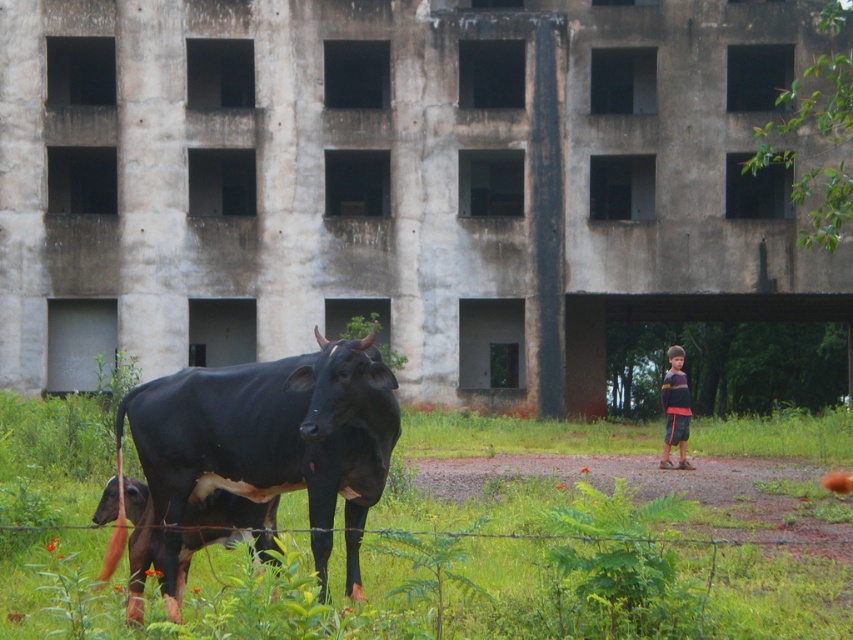
Question: Is green grass at lower left in front of black glossy bull at center?

Choices:
 (A) yes
 (B) no

Answer: (A)

Question: Which point is closer to the camera?

Choices:
 (A) black glossy bull at center
 (B) green grass at lower left
 (C) striped long-sleeve shirt at right

Answer: (B)

Question: Among these points, which one is farthest from the camera?

Choices:
 (A) (323, 476)
 (B) (744, 557)
 (C) (685, 404)

Answer: (C)

Question: Among these objects, which one is nearest to the camera?

Choices:
 (A) black glossy bull at center
 (B) striped long-sleeve shirt at right

Answer: (A)

Question: Does black glossy bull at center have a smaller size compared to striped long-sleeve shirt at right?

Choices:
 (A) no
 (B) yes

Answer: (B)

Question: Where is black glossy bull at center located in relation to striped long-sleeve shirt at right in the image?

Choices:
 (A) below
 (B) above

Answer: (B)